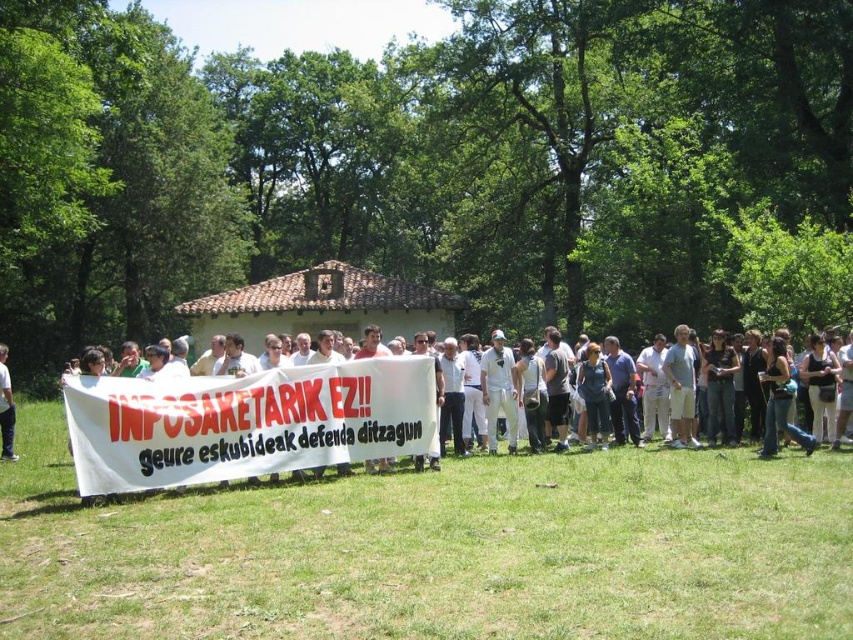
You are a photographer trying to capture a clear photo of the white cloth banner at center and the white cotton shirt at lower left. However, you notice that the banner is blocking the view of the shirt. Can you adjust your position to see both objects clearly without moving them?

The white cloth banner at center is in front of the white cotton shirt at lower left, so moving your camera angle slightly downward or to the side might allow you to capture both objects without obstruction.

You are a photographer trying to capture the banner held by the protesters. You notice two points marked on your camera screen at coordinates point (144, 397) and point (3, 378). Which point is closer to your camera lens?

Point (144, 397) is closer to the camera lens than point (3, 378).

You are a photographer trying to capture the protest scene. You need to ensure both the white cloth banner at center and the white cotton shirt at lower left are visible in your shot. Given their sizes, which object should you focus on to ensure both are in frame without cropping?

The white cloth banner at center is bigger than the white cotton shirt at lower left. To ensure both are in frame without cropping, focus on capturing the larger white cloth banner at center first, then adjust the shot to include the smaller white cotton shirt at lower left.